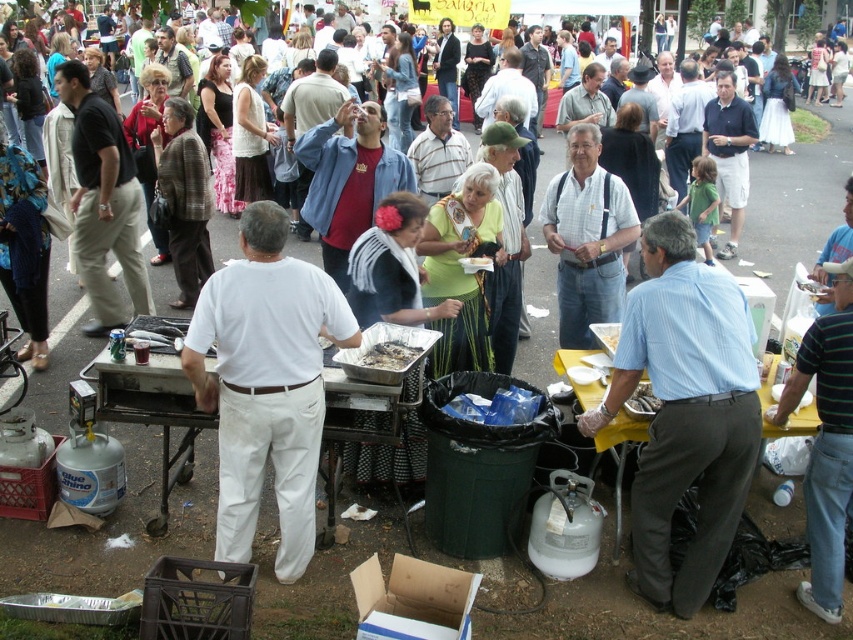
Does charcoal gray metal grill at center appear over shiny silver tray at center?

Actually, charcoal gray metal grill at center is below shiny silver tray at center.

Can you confirm if charcoal gray metal grill at center is bigger than shiny silver tray at center?

Incorrect, charcoal gray metal grill at center is not larger than shiny silver tray at center.

The height and width of the screenshot is (640, 853). Find the location of `charcoal gray metal grill at center`. charcoal gray metal grill at center is located at coordinates (390, 355).

Between white cotton shirt at center and charcoal gray metal grill at center, which one appears on the left side from the viewer's perspective?

white cotton shirt at center

Between point (221, 468) and point (383, 360), which one is positioned behind?

Point (383, 360)

At what (x,y) coordinates should I click in order to perform the action: click on white cotton shirt at center. Please return your answer as a coordinate pair (x, y). This screenshot has height=640, width=853. Looking at the image, I should click on (265, 384).

Find the location of `white cotton shirt at center`. white cotton shirt at center is located at coordinates 265,384.

Which of these two, light blue striped shirt at center or shiny silver spoon at lower center, stands taller?

light blue striped shirt at center is taller.

Identify the location of light blue striped shirt at center. (683, 412).

Between point (643, 477) and point (642, 406), which one is positioned behind?

Positioned behind is point (642, 406).

Locate an element on the screen. The width and height of the screenshot is (853, 640). light blue striped shirt at center is located at coordinates (683, 412).